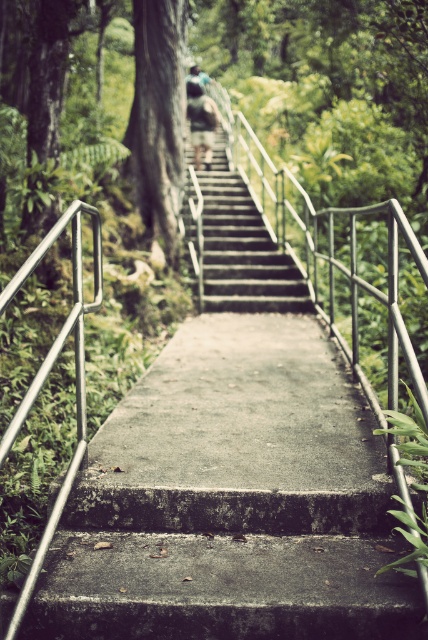
Does concrete/steps at center lie in front of green fabric shirt at upper center?

Yes, it is in front of green fabric shirt at upper center.

Who is shorter, concrete/steps at center or green fabric shirt at upper center?

With less height is concrete/steps at center.

Is point (220, 259) positioned in front of point (214, 104)?

Yes.

The width and height of the screenshot is (428, 640). In order to click on concrete/steps at center in this screenshot , I will do `click(235, 244)`.

Does green rough bark tree at center have a lesser height compared to green fabric shirt at upper center?

No, green rough bark tree at center is not shorter than green fabric shirt at upper center.

Who is more forward, (169, 195) or (205, 97)?

Point (169, 195) is more forward.

At what (x,y) coordinates should I click in order to perform the action: click on green rough bark tree at center. Please return your answer as a coordinate pair (x, y). Looking at the image, I should click on (157, 115).

Does concrete/steps at center have a smaller size compared to silver metallic handrail at left?

Actually, concrete/steps at center might be larger than silver metallic handrail at left.

Which is in front, point (291, 266) or point (38, 544)?

Point (38, 544) is in front.

What do you see at coordinates (235, 244) in the screenshot? I see `concrete/steps at center` at bounding box center [235, 244].

Locate an element on the screen. This screenshot has width=428, height=640. concrete/steps at center is located at coordinates (235, 244).